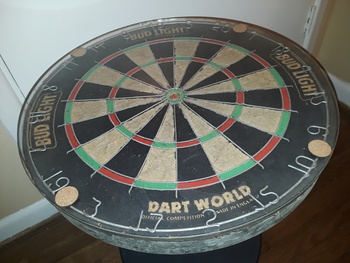
Locate an element on the screen. This screenshot has width=350, height=263. door is located at coordinates (53, 29).